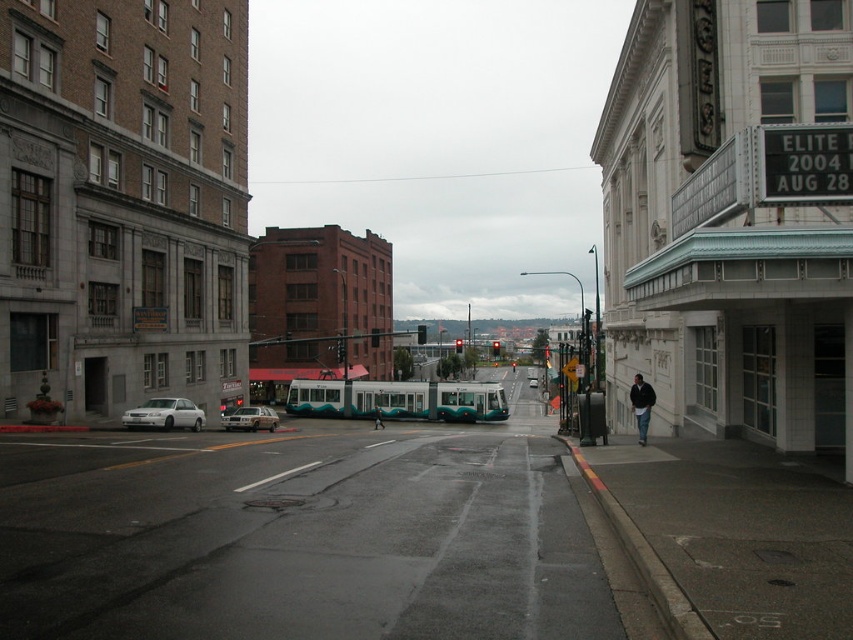
Question: Which point is farther from the camera taking this photo?

Choices:
 (A) (375, 426)
 (B) (579, 401)

Answer: (A)

Question: Which of the following is the closest to the observer?

Choices:
 (A) dark blue jeans at center
 (B) white matte sedan at center
 (C) white matte sedan at left

Answer: (C)

Question: Which object is the farthest from the metallic silver sedan at center?

Choices:
 (A) dark blue jacket at lower right
 (B) white matte sedan at center
 (C) dark blue jeans at center

Answer: (B)

Question: Is the position of dark blue jacket at lower right more distant than that of white matte sedan at center?

Choices:
 (A) yes
 (B) no

Answer: (B)

Question: Can you confirm if dark blue jeans at center is positioned to the left of white matte sedan at center?

Choices:
 (A) yes
 (B) no

Answer: (A)

Question: Where is metallic green bus stop at center-right located in relation to dark blue jeans at center in the image?

Choices:
 (A) below
 (B) above

Answer: (B)